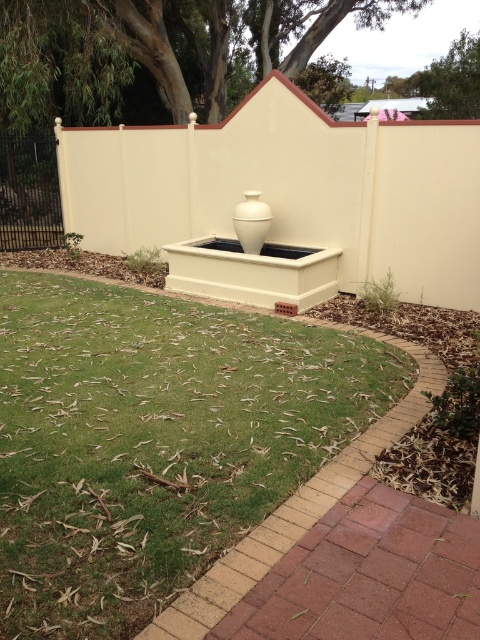
You are standing in the garden and want to place a decorative item that requires a distance of at least 2 meters from the viewer to avoid obstruction. Can the brick at lower right be used for this purpose?

The brick at lower right is only 1.93 meters away from the viewer, which is less than the required 2 meters. Therefore, it cannot be used for placing the decorative item that needs at least 2 meters distance.

You are standing in the garden and want to place a small potted plant. The potted plant must be placed exactly at the coordinates point [298,504]. What is already located at that position?

The brick at lower right is located at point [298,504].

You are standing in the garden and want to place a small potted plant exactly at the point marked by coordinates [298,504]. According to the scene description, where in the garden will this potted plant be placed?

The point marked by coordinates [298,504] corresponds to the brick at lower right, so placing the potted plant there would position it on the brick at lower right.